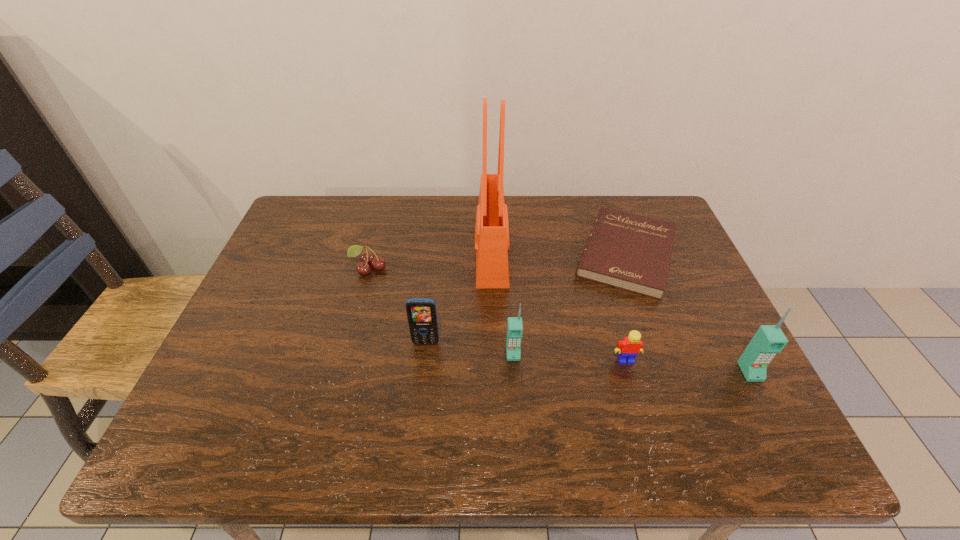
Where is `the second cellular telephone from left to right`? This screenshot has width=960, height=540. the second cellular telephone from left to right is located at coordinates (514, 326).

The width and height of the screenshot is (960, 540). Identify the location of the rightmost cellular telephone. (769, 339).

The image size is (960, 540). I want to click on the second tallest object, so click(x=769, y=339).

This screenshot has height=540, width=960. I want to click on hardback book, so click(631, 252).

The width and height of the screenshot is (960, 540). I want to click on the second shortest object, so click(x=367, y=258).

You are a GUI agent. You are given a task and a screenshot of the screen. Output one action in this format:
    pyautogui.click(x=<x>, y=<y>)
    Task: Click on the cherry
    
    Given the screenshot: What is the action you would take?
    pyautogui.click(x=367, y=258)

In order to click on tote bag in this screenshot , I will do `click(492, 244)`.

The image size is (960, 540). I want to click on Lego, so click(x=628, y=348).

You are a GUI agent. You are given a task and a screenshot of the screen. Output one action in this format:
    pyautogui.click(x=<x>, y=<y>)
    Task: Click on the sixth object from right to left
    The image size is (960, 540).
    Given the screenshot: What is the action you would take?
    pyautogui.click(x=421, y=312)

Image resolution: width=960 pixels, height=540 pixels. Identify the location of free space located 0.110m on the keypad of the second cellular telephone from left to right. (516, 406).